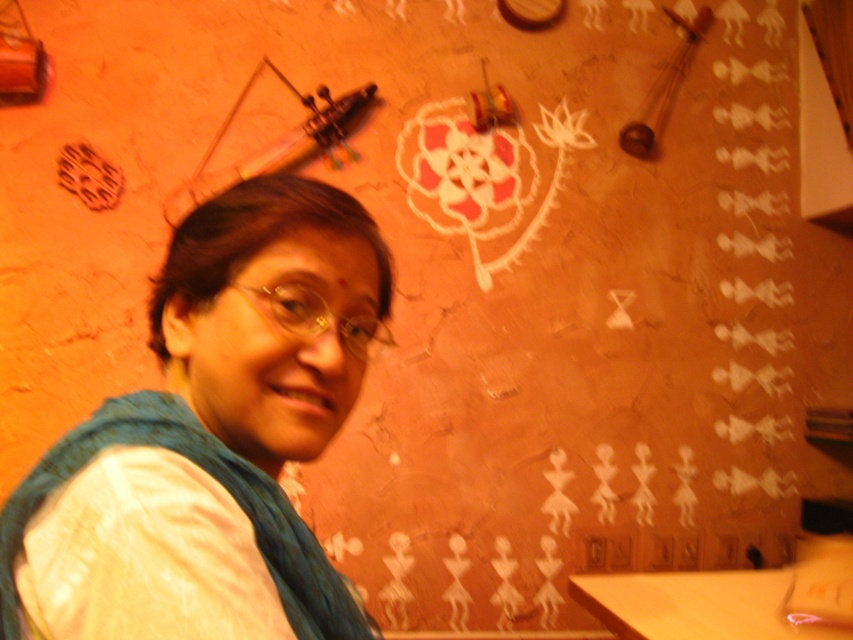
Does white fabric at center have a greater height compared to wooden table at lower right?

Yes, white fabric at center is taller than wooden table at lower right.

Does white fabric at center have a larger size compared to wooden table at lower right?

No, white fabric at center is not bigger than wooden table at lower right.

I want to click on white fabric at center, so tap(212, 438).

Does blue fabric scarf at upper left lie behind wooden table at lower right?

No, blue fabric scarf at upper left is closer to the viewer.

Who is positioned more to the left, blue fabric scarf at upper left or wooden table at lower right?

Positioned to the left is blue fabric scarf at upper left.

Where is `blue fabric scarf at upper left`? The image size is (853, 640). blue fabric scarf at upper left is located at coordinates (212, 474).

Who is more distant from viewer, (202, 509) or (91, 451)?

Positioned behind is point (91, 451).

Does white fabric at center have a lesser width compared to blue fabric scarf at upper left?

Incorrect, white fabric at center's width is not less than blue fabric scarf at upper left's.

Where is `white fabric at center`? This screenshot has height=640, width=853. white fabric at center is located at coordinates (212, 438).